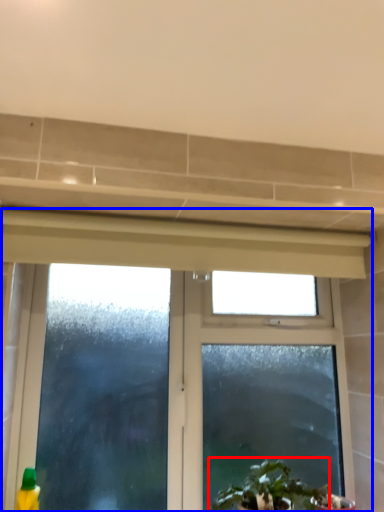
Question: Among these objects, which one is farthest to the camera, houseplant (highlighted by a red box) or window (highlighted by a blue box)?

Choices:
 (A) houseplant
 (B) window

Answer: (B)